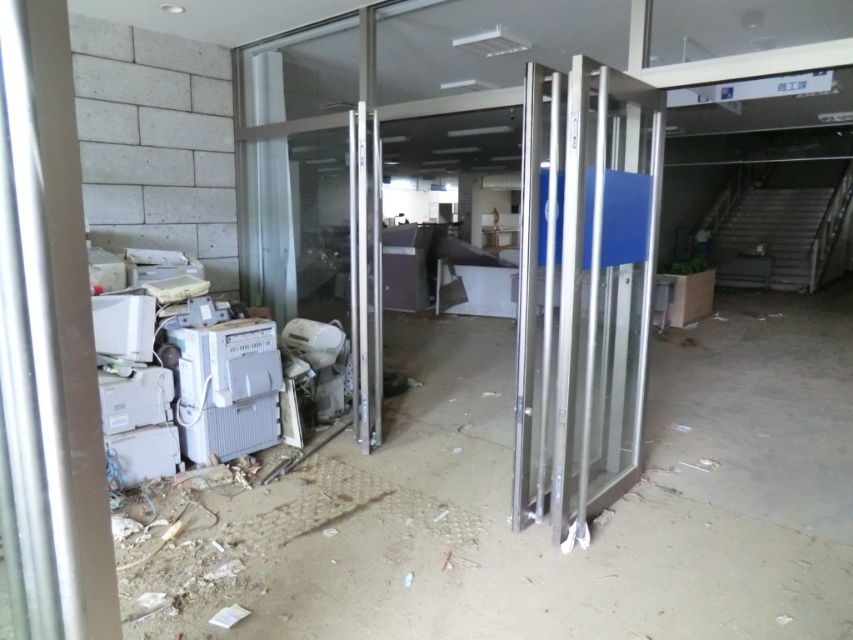
Question: Can you confirm if metallic gray electronics at lower left is positioned below polished silver glass door at center?

Choices:
 (A) yes
 (B) no

Answer: (A)

Question: Can you confirm if metallic gray electronics at lower left is thinner than polished silver glass door at center?

Choices:
 (A) no
 (B) yes

Answer: (A)

Question: Can you confirm if metallic gray electronics at lower left is positioned to the right of polished silver glass door at center?

Choices:
 (A) yes
 (B) no

Answer: (A)

Question: Among these points, which one is farthest from the camera?

Choices:
 (A) click(635, 564)
 (B) click(598, 138)

Answer: (A)

Question: Which of the following is the farthest from the observer?

Choices:
 (A) metallic gray electronics at lower left
 (B) polished silver glass door at center

Answer: (A)